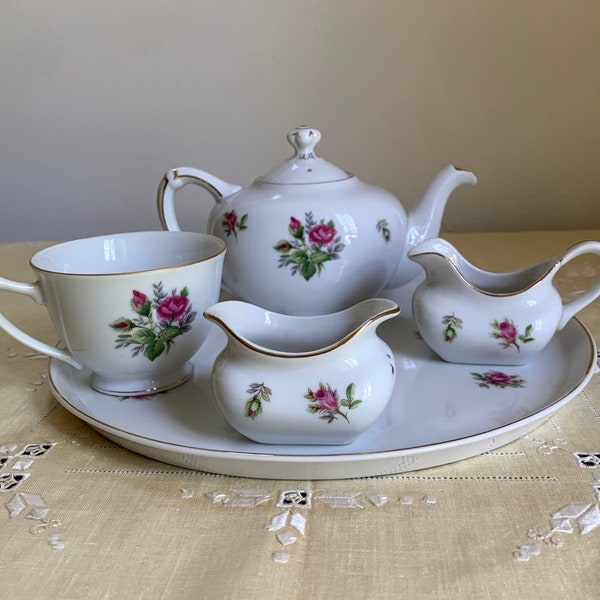
You are a GUI agent. You are given a task and a screenshot of the screen. Output one action in this format:
    pyautogui.click(x=<x>, y=<y>)
    Task: Click on the wall
    This screenshot has width=600, height=600.
    Given the screenshot: What is the action you would take?
    100,138